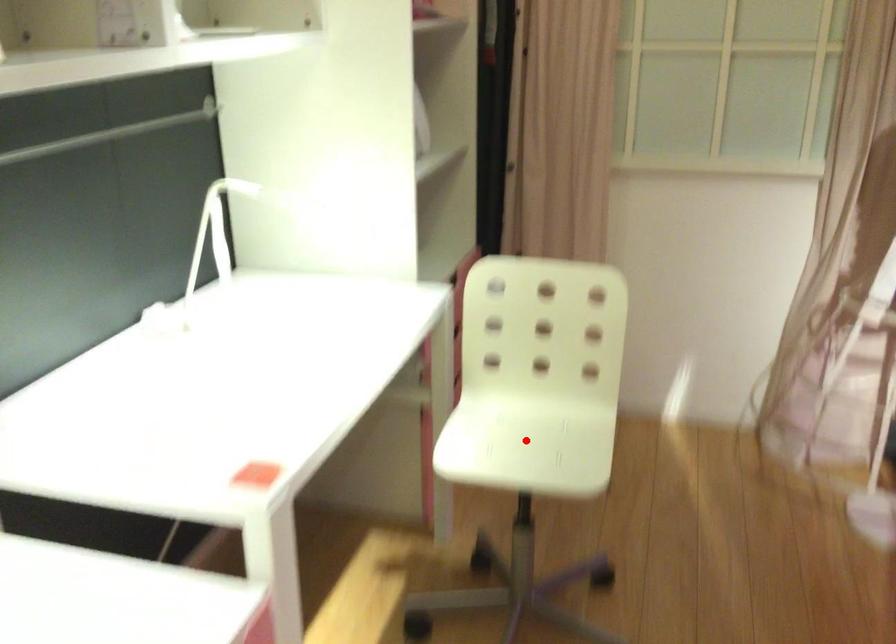
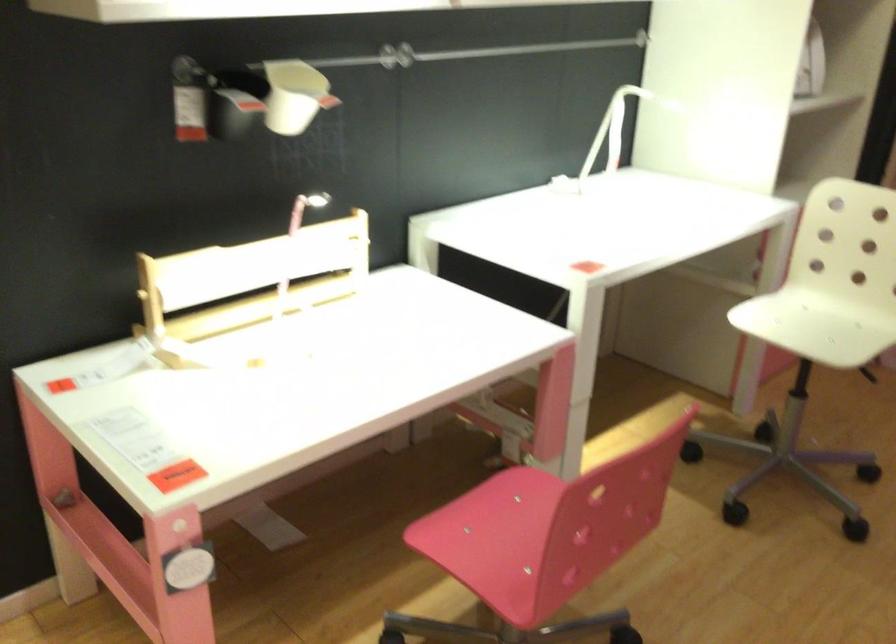
In the second image, find the point that corresponds to the highlighted location in the first image.

(812, 327)